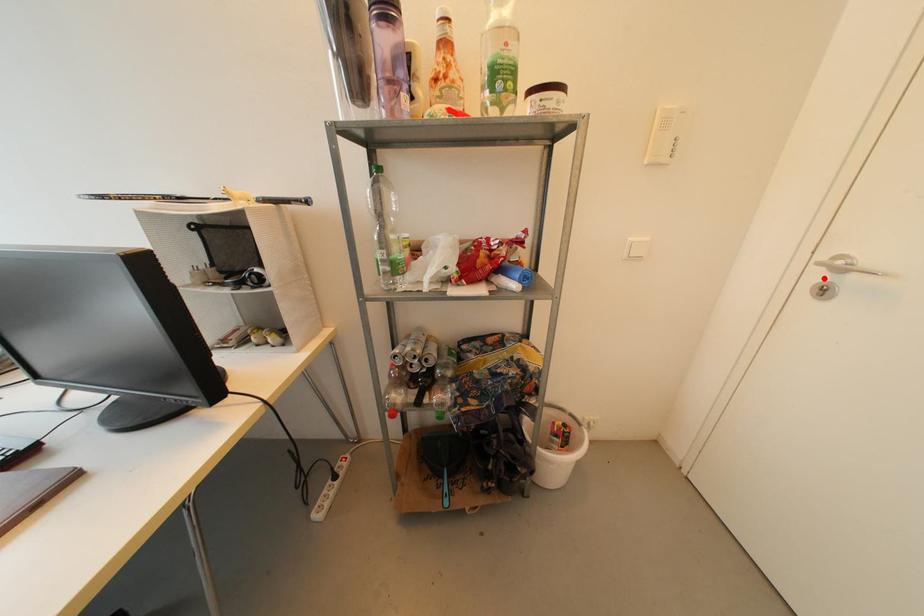
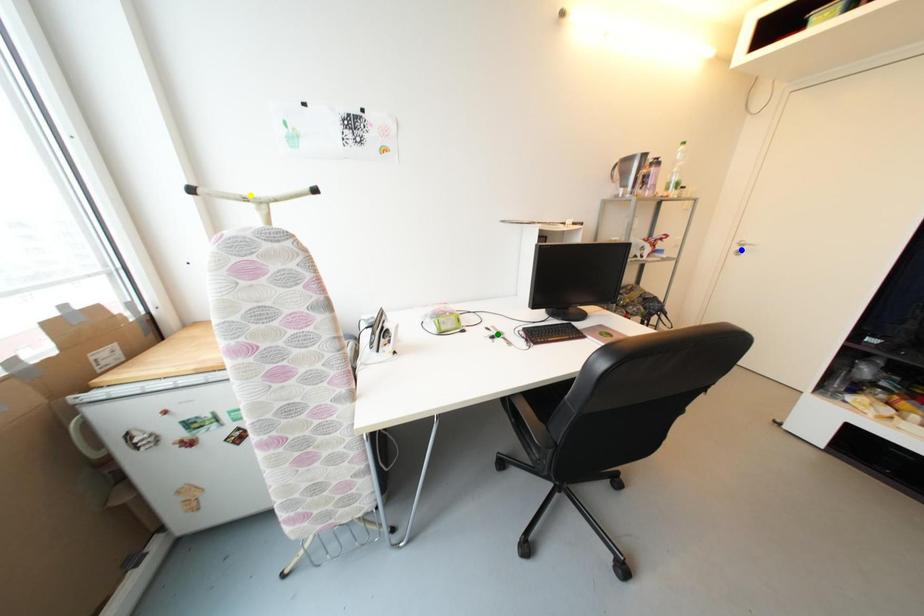
Question: I am providing you with two images of the same scene from different viewpoints. A red point is marked on the first image. You are given multiple points on the second image. Which spot in image 2 lines up with the point in image 1?

Choices:
 (A) yellow point
 (B) green point
 (C) blue point

Answer: (C)